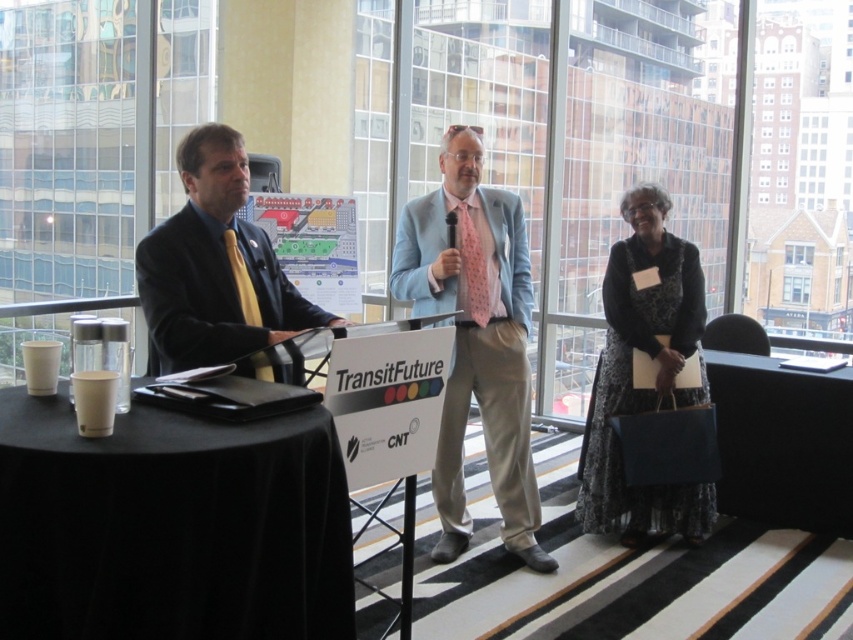
Can you confirm if light blue fabric suit at center is shorter than floral-patterned dress at right?

Incorrect, light blue fabric suit at center's height does not fall short of floral-patterned dress at right's.

Between point (473, 221) and point (624, 260), which one is positioned in front?

Positioned in front is point (473, 221).

Where is `light blue fabric suit at center`? The height and width of the screenshot is (640, 853). light blue fabric suit at center is located at coordinates (476, 339).

Can you confirm if black fabric table at lower left is positioned above floral-patterned dress at right?

Incorrect, black fabric table at lower left is not positioned above floral-patterned dress at right.

Between black fabric table at lower left and floral-patterned dress at right, which one appears on the left side from the viewer's perspective?

black fabric table at lower left is more to the left.

Measure the distance between black fabric table at lower left and camera.

A distance of 1.82 meters exists between black fabric table at lower left and camera.

At what (x,y) coordinates should I click in order to perform the action: click on black fabric table at lower left. Please return your answer as a coordinate pair (x, y). This screenshot has height=640, width=853. Looking at the image, I should click on (171, 525).

Is black fabric table at lower left positioned in front of light blue fabric suit at center?

Yes, black fabric table at lower left is in front of light blue fabric suit at center.

Describe the element at coordinates (171, 525) in the screenshot. I see `black fabric table at lower left` at that location.

This screenshot has width=853, height=640. What do you see at coordinates (171, 525) in the screenshot? I see `black fabric table at lower left` at bounding box center [171, 525].

The width and height of the screenshot is (853, 640). Identify the location of black fabric table at lower left. (171, 525).